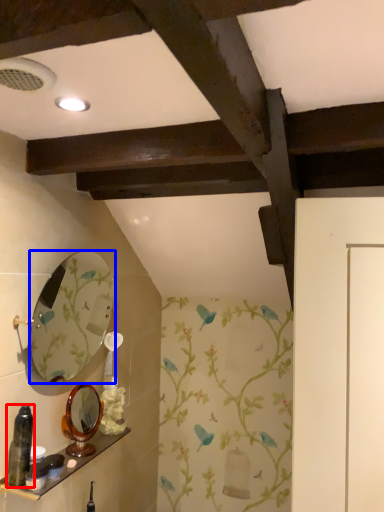
Question: Which point is further to the camera, bottle (highlighted by a red box) or mirror (highlighted by a blue box)?

Choices:
 (A) bottle
 (B) mirror

Answer: (B)